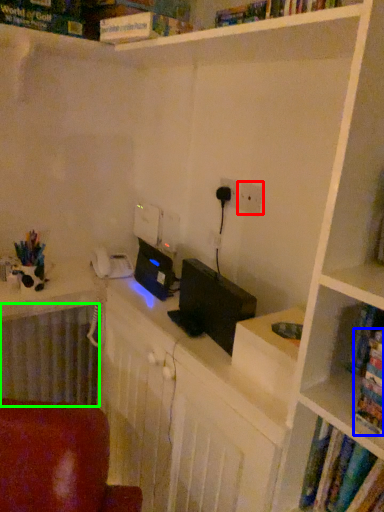
Question: Which is nearer to the electric outlet (highlighted by a red box)? book (highlighted by a blue box) or radiator (highlighted by a green box).

Choices:
 (A) book
 (B) radiator

Answer: (A)